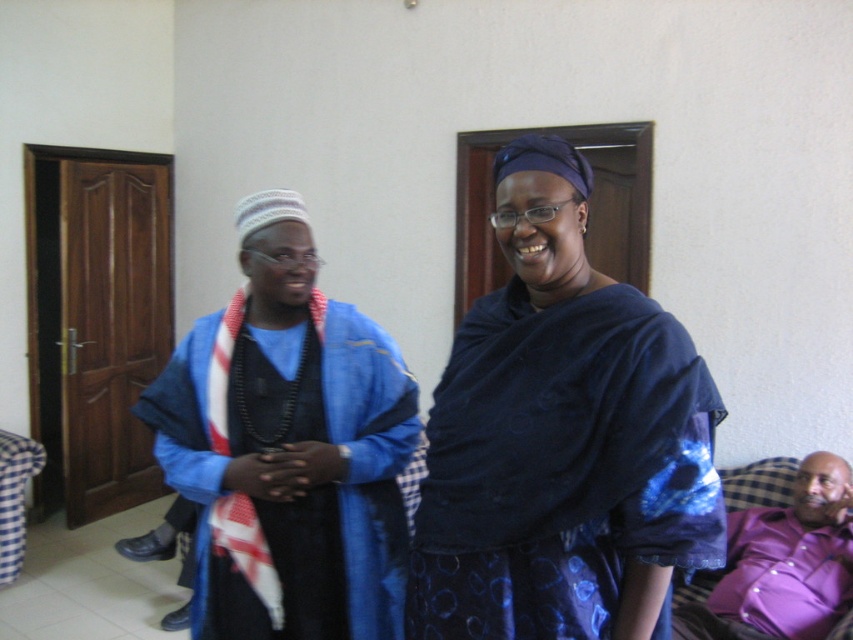
You are organizing a fashion show and need to decide which outfit to display first. Which of the following is smaller in size between the blue satin dress at center and the purple satin shirt at lower right?

The blue satin dress at center is smaller than the purple satin shirt at lower right, so it should be displayed first.

You are standing in the room and want to touch the point at coordinates (x=369, y=460). Which object in the scene is located at this point?

The point at coordinates (x=369, y=460) is on the blue textured robe at center.

In the scene described, there are two people in the foreground. One is a woman in a dark blue outfit with a patterned design, and the other is a man in a blue shirt and shawl. There is also a point marked at coordinates (561, 438). What object is located at this point?

The point at coordinates (561, 438) marks the blue satin dress at center.